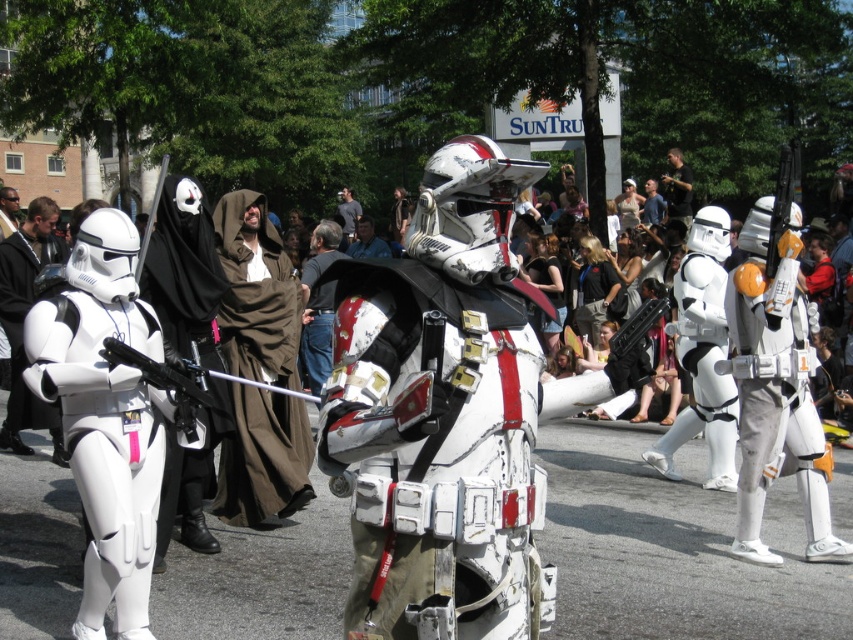
The image size is (853, 640). What do you see at coordinates (444, 416) in the screenshot?
I see `white matte armor at center` at bounding box center [444, 416].

Where is `white matte armor at center`? Image resolution: width=853 pixels, height=640 pixels. white matte armor at center is located at coordinates (444, 416).

Is point (677, 172) closer to viewer compared to point (659, 202)?

No, it is behind (659, 202).

Is dark gray fabric shirt at center to the left of blue fabric shirt at center from the viewer's perspective?

Incorrect, dark gray fabric shirt at center is not on the left side of blue fabric shirt at center.

I want to click on dark gray fabric shirt at center, so click(677, 188).

Who is positioned more to the right, white matte stormtrooper armor at left or dark gray fabric shirt at center?

Positioned to the right is dark gray fabric shirt at center.

Does white matte stormtrooper armor at left have a lesser width compared to dark gray fabric shirt at center?

Incorrect, white matte stormtrooper armor at left's width is not less than dark gray fabric shirt at center's.

Find the location of `white matte stormtrooper armor at left`. white matte stormtrooper armor at left is located at coordinates (22, 321).

You are a GUI agent. You are given a task and a screenshot of the screen. Output one action in this format:
    pyautogui.click(x=<x>, y=<y>)
    Task: Click on the white matte stormtrooper armor at left
    
    Given the screenshot: What is the action you would take?
    pyautogui.click(x=22, y=321)